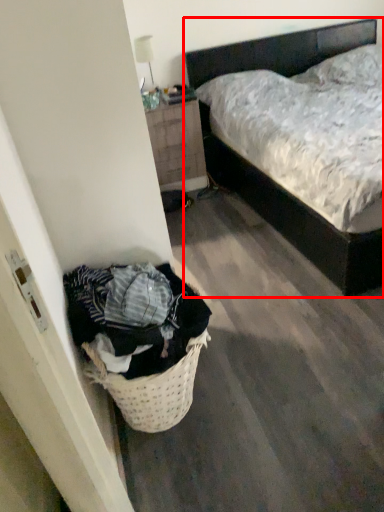
Question: Considering the relative positions of bed (annotated by the red box) and nightstand in the image provided, where is bed (annotated by the red box) located with respect to the staircase?

Choices:
 (A) left
 (B) right

Answer: (B)